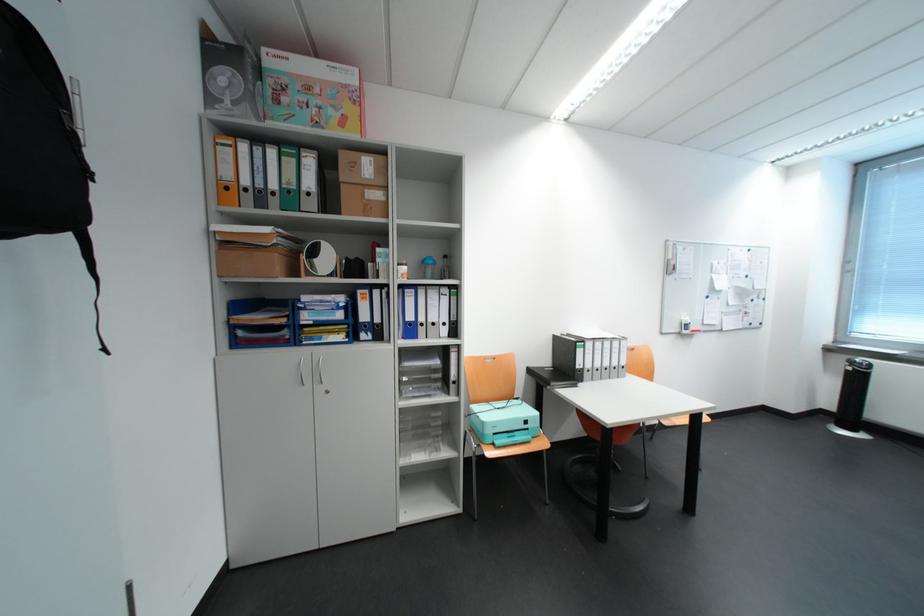
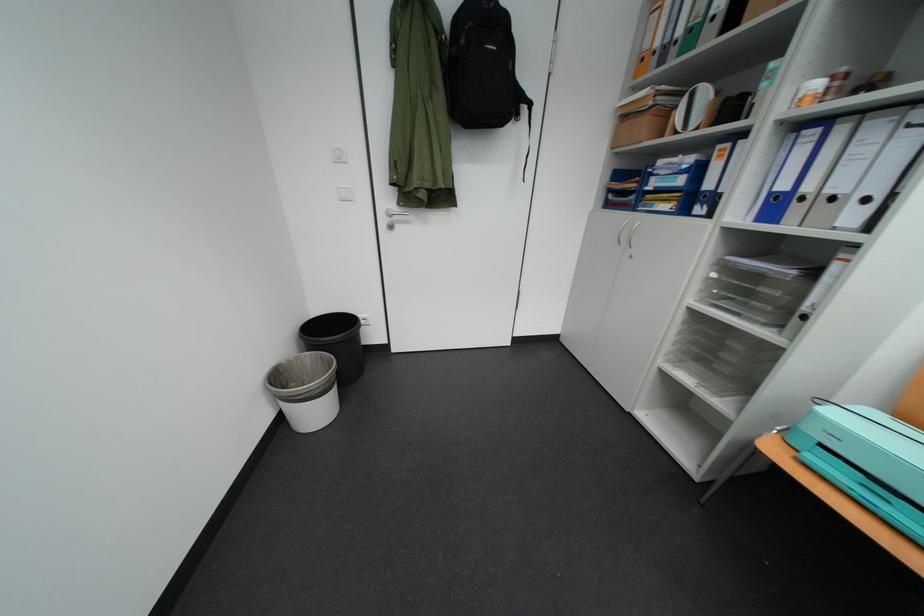
The point at (442, 322) is marked in the first image. Where is the corresponding point in the second image?

(841, 193)